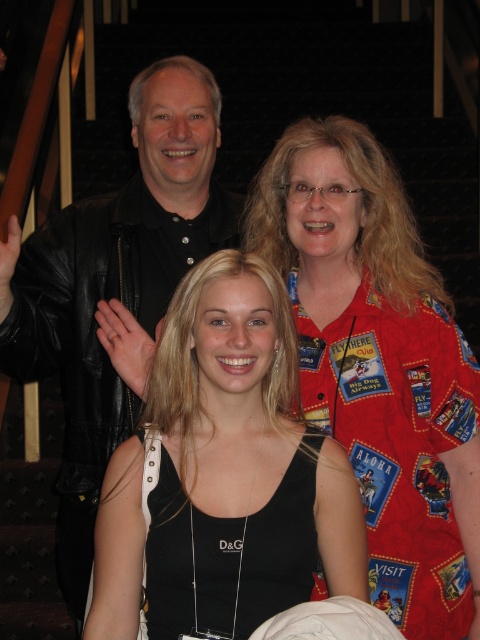
What is the relationship between the thickness of the red patchwork shirt at upper right and the black fabric tank top at center?

The red patchwork shirt at upper right is thinner than the black fabric tank top at center.

You are a photographer trying to capture a group photo. You notice two black fabric items at the center of the image. Which one is bigger in size between the black fabric tank top at center and the black fabric dress at center?

The black fabric tank top at center is larger in size compared to the black fabric dress at center according to the description.

You are a photographer trying to adjust the lighting for a group photo. You notice the red patchwork shirt at upper right and the black fabric tank top at center. Which clothing item requires more light to ensure it doesn not appear too dark in the final photo?

The red patchwork shirt at upper right requires more light because it is bigger than the black fabric tank top at center, so it may need more illumination to maintain visibility.